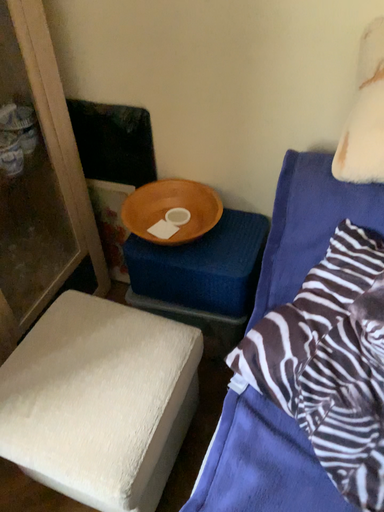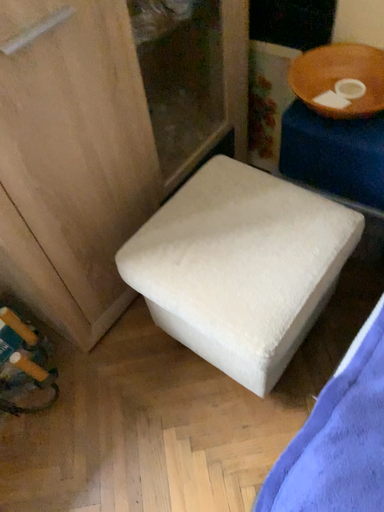
Question: How did the camera likely rotate when shooting the video?

Choices:
 (A) rotated downward
 (B) rotated upward

Answer: (A)